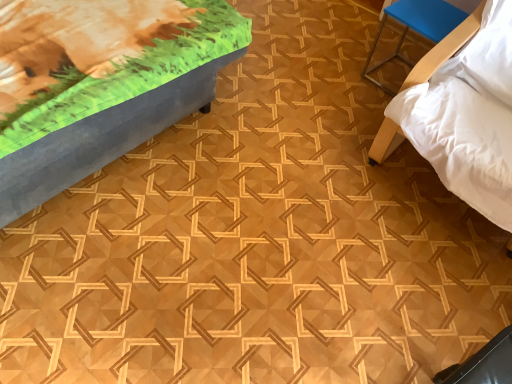
Find the location of `blank space to the left of white soft bed at right, the first furniture from the right`. blank space to the left of white soft bed at right, the first furniture from the right is located at coordinates (296, 150).